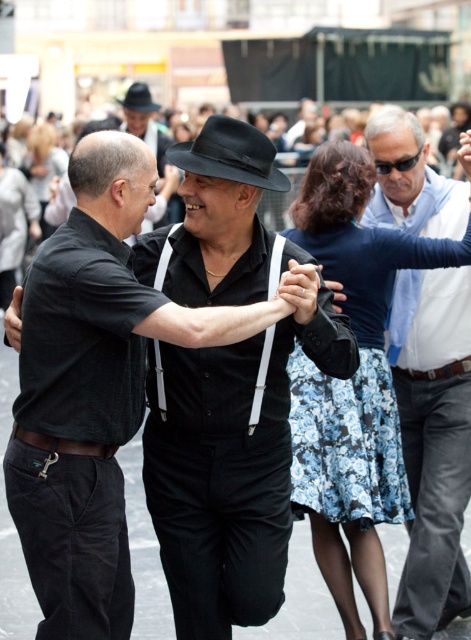
Between black leather belt at lower right and black felt fedora at upper center, which one appears on the left side from the viewer's perspective?

From the viewer's perspective, black felt fedora at upper center appears more on the left side.

From the picture: Who is shorter, black leather belt at lower right or black felt fedora at upper center?

With less height is black leather belt at lower right.

Does point (446, 372) lie in front of point (146, 90)?

Yes, it is in front of point (146, 90).

Identify the location of black leather belt at lower right. The width and height of the screenshot is (471, 640). (438, 371).

Who is higher up, black felt fedora at center or black felt fedora at upper center?

black felt fedora at upper center

In the scene shown: Who is more distant from viewer, [226,116] or [148,96]?

Result: The point [148,96] is more distant.

Who is more forward, (x=260, y=168) or (x=146, y=106)?

Point (x=260, y=168) is more forward.

Locate an element on the screen. black felt fedora at center is located at coordinates (230, 154).

Which of these two, black matte suspenders at center or black felt fedora at center, stands shorter?

black felt fedora at center is shorter.

Who is higher up, black matte suspenders at center or black felt fedora at center?

black felt fedora at center is above.

Who is more forward, (160,504) or (221,132)?

Point (221,132)

The width and height of the screenshot is (471, 640). I want to click on black matte suspenders at center, so click(x=234, y=460).